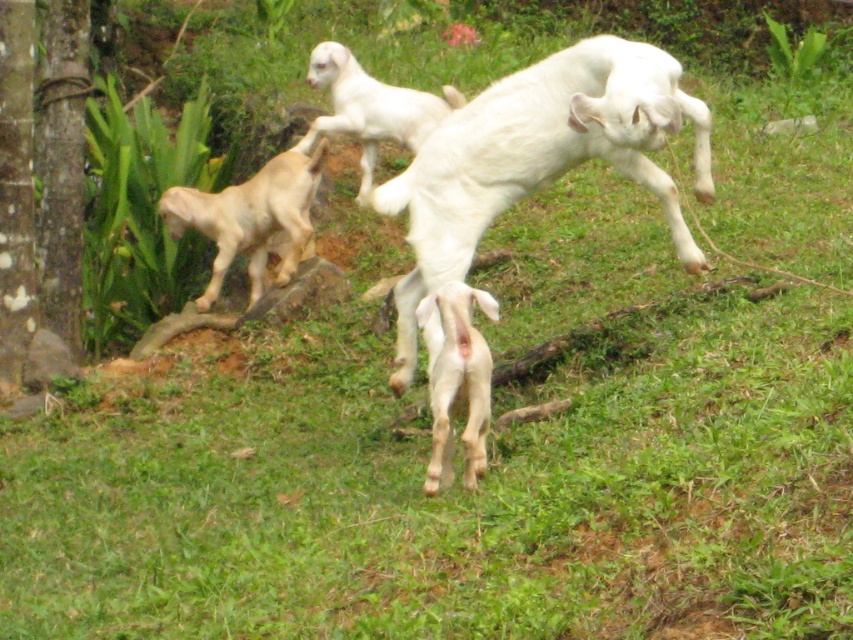
You are a farmer checking on your goats. You notice the white woolen goat at center and the light beige fur at left. Which goat should you approach first if you want to pet the taller one?

You should approach the white woolen goat at center first because it is taller than the light beige fur at left according to the description.

In the scene shown: You are standing at the origin point of the coordinate system and see the image. What object is located at point [538,157]?

The point [538,157] marks the white woolen goat at center.

From the picture: You are standing in a field and see the white woolen goat at center. If you want to throw a ball to the goat, and your throwing range is up to 5 meters, will you be able to reach it?

The white woolen goat at center is 5.25 meters away from the viewer. Since your throwing range is up to 5 meters, you cannot reach it.